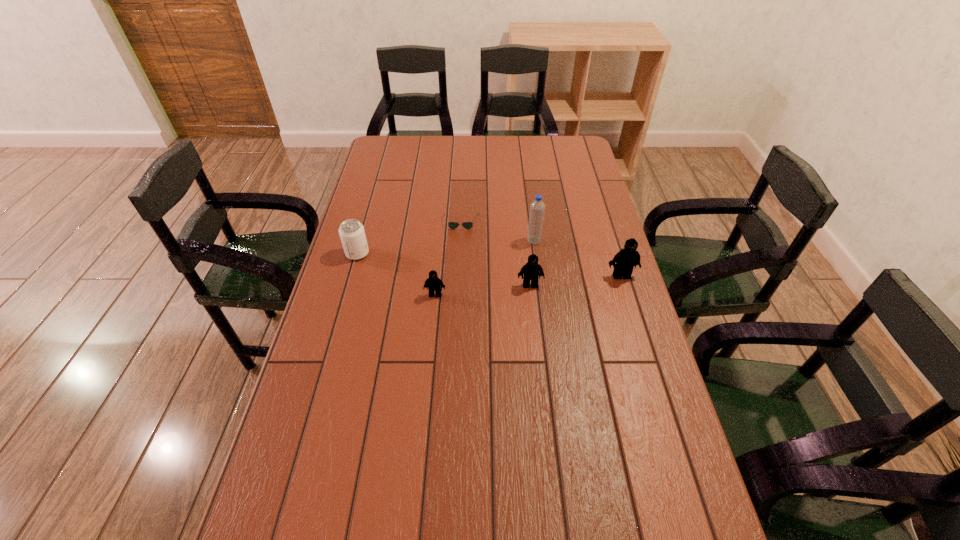
What are the coordinates of `the farthest object` in the screenshot? It's located at (452, 225).

Locate an element on the screen. sunglasses is located at coordinates (452, 225).

Where is `vacant area located 0.310m on the face of the shortest Lego`? The width and height of the screenshot is (960, 540). vacant area located 0.310m on the face of the shortest Lego is located at coordinates (426, 389).

This screenshot has height=540, width=960. In order to click on free space located 0.320m on the face of the second shortest Lego in this screenshot , I will do `click(540, 380)`.

Locate an element on the screen. Image resolution: width=960 pixels, height=540 pixels. vacant space located on the face of the rightmost Lego is located at coordinates (630, 304).

The image size is (960, 540). I want to click on free space located 0.090m on the back of the second farthest object, so click(531, 220).

This screenshot has height=540, width=960. What are the coordinates of `vacant position located 0.230m on the front of the leftmost object` in the screenshot? It's located at (340, 316).

Where is `vacant region located 0.250m on the lenses of the sunglasses`? This screenshot has width=960, height=540. vacant region located 0.250m on the lenses of the sunglasses is located at coordinates click(458, 281).

You are a GUI agent. You are given a task and a screenshot of the screen. Output one action in this format:
    pyautogui.click(x=<x>, y=<y>)
    Task: Click on the object at the left edge
    This screenshot has width=960, height=540.
    Given the screenshot: What is the action you would take?
    pyautogui.click(x=351, y=231)

This screenshot has width=960, height=540. What are the coordinates of `object that is at the right edge` in the screenshot? It's located at (624, 261).